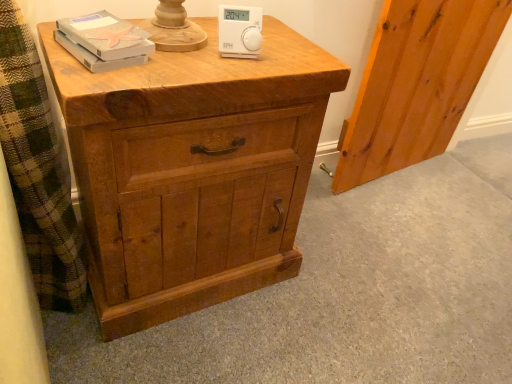
Where is `vacant area that lies to the right of natural wood chest of drawers at center`? Image resolution: width=512 pixels, height=384 pixels. vacant area that lies to the right of natural wood chest of drawers at center is located at coordinates (331, 292).